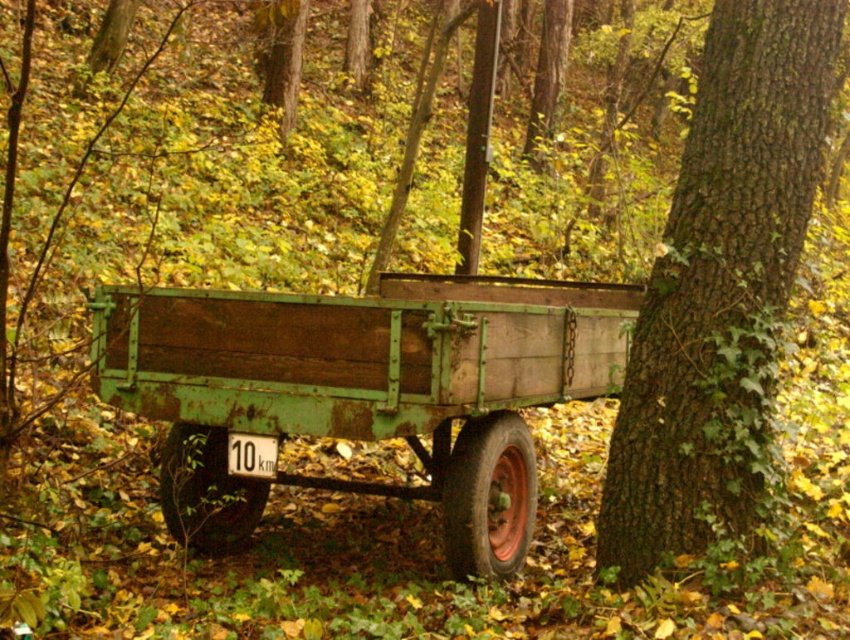
Question: Which point is closer to the camera?

Choices:
 (A) (187, 397)
 (B) (727, 435)

Answer: (B)

Question: Which point appears farthest from the camera in this image?

Choices:
 (A) (211, 420)
 (B) (259, 472)

Answer: (A)

Question: Which of these objects is positioned closest to the white plastic sign at center?

Choices:
 (A) green rough bark tree at center right
 (B) rusty wood wagon at center

Answer: (B)

Question: Does rusty wood wagon at center appear on the right side of white plastic sign at center?

Choices:
 (A) no
 (B) yes

Answer: (B)

Question: Is green rough bark tree at center right to the right of white plastic sign at center from the viewer's perspective?

Choices:
 (A) yes
 (B) no

Answer: (A)

Question: Does green rough bark tree at center right have a greater width compared to white plastic sign at center?

Choices:
 (A) yes
 (B) no

Answer: (A)